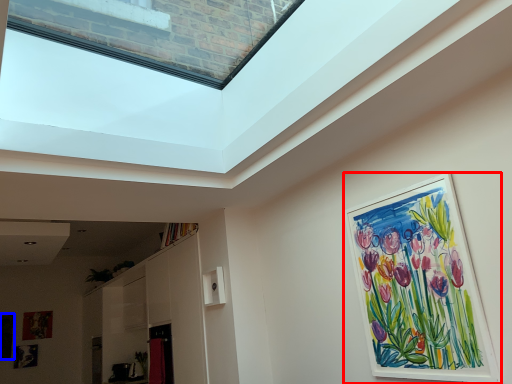
Question: Which point is further to the camera, picture frame (highlighted by a red box) or picture frame (highlighted by a blue box)?

Choices:
 (A) picture frame
 (B) picture frame

Answer: (B)